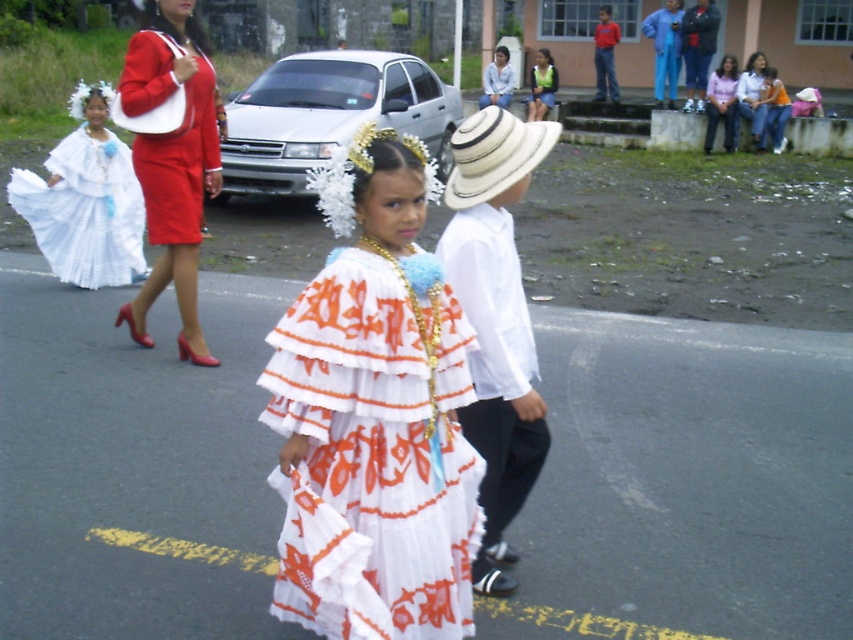
You are an artist sketching the scene from the image. You want to draw the white pleated dress at center first. Where should you place it on your canvas if the canvas coordinates are from 0 to 1 in both x and y axes?

The white pleated dress at center should be placed at the coordinates point (374, 452) on the canvas.

Looking at this image, you are a photographer trying to capture the scene. You notice the white pleated dress at center and the blue fabric pants at upper right. Which object should you focus on if you want to photograph the taller one?

The blue fabric pants at upper right are taller than the white pleated dress at center, so you should focus on the blue fabric pants at upper right to photograph the taller one.

You are a photographer positioned in the crowd at the event. You want to capture a photo of both the white straw hat at center and the white cotton blouse at upper center in the same frame. Which object should you focus on first to ensure both are in focus?

You should focus on the white straw hat at center first because it is closer to the viewer than the white cotton blouse at upper center. By focusing on the closer object, the background object will still be in focus due to the depth of field.